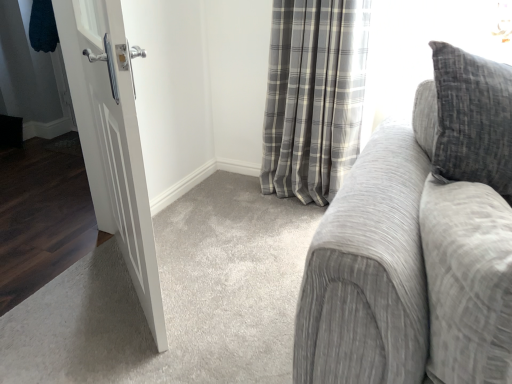
Question: From a real-world perspective, is textured gray couch at right positioned above or below gray plaid curtain at center?

Choices:
 (A) above
 (B) below

Answer: (A)

Question: Considering their positions, is textured gray couch at right located in front of or behind gray plaid curtain at center?

Choices:
 (A) behind
 (B) front

Answer: (B)

Question: Estimate the real-world distances between objects in this image. Which object is farther from the textured gray couch at right?

Choices:
 (A) gray plaid curtain at center
 (B) white matte door at left

Answer: (A)

Question: Estimate the real-world distances between objects in this image. Which object is closer to the white matte door at left?

Choices:
 (A) gray plaid curtain at center
 (B) textured gray couch at right

Answer: (B)